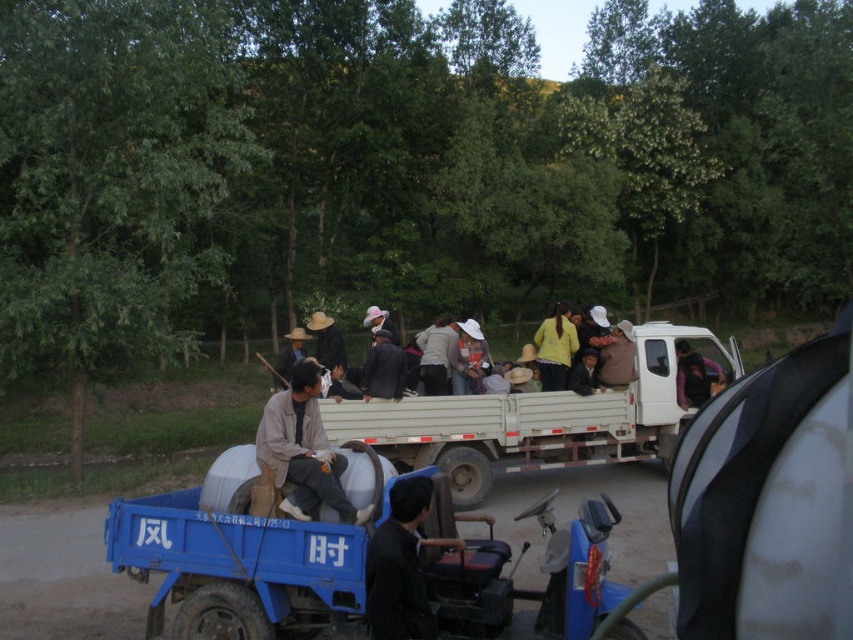
Question: Observing the image, what is the correct spatial positioning of yellow matte shirt at center in reference to dark gray fabric jacket at center?

Choices:
 (A) below
 (B) above

Answer: (B)

Question: Is light brown straw hat at center further to the viewer compared to yellow matte shirt at center?

Choices:
 (A) yes
 (B) no

Answer: (B)

Question: Which of the following is the closest to the observer?

Choices:
 (A) (706, 596)
 (B) (567, 362)
 (C) (387, 336)

Answer: (A)

Question: Which point is closer to the camera?

Choices:
 (A) click(292, 465)
 (B) click(398, 577)
 (C) click(840, 401)
 (D) click(386, 394)

Answer: (C)

Question: Can you confirm if white matte pickup truck at center is positioned to the left of light brown straw hat at center?

Choices:
 (A) no
 (B) yes

Answer: (A)

Question: Which object is the closest to the black matte jacket at lower center?

Choices:
 (A) light brown fabric jacket at center
 (B) white matte pickup truck at center

Answer: (A)